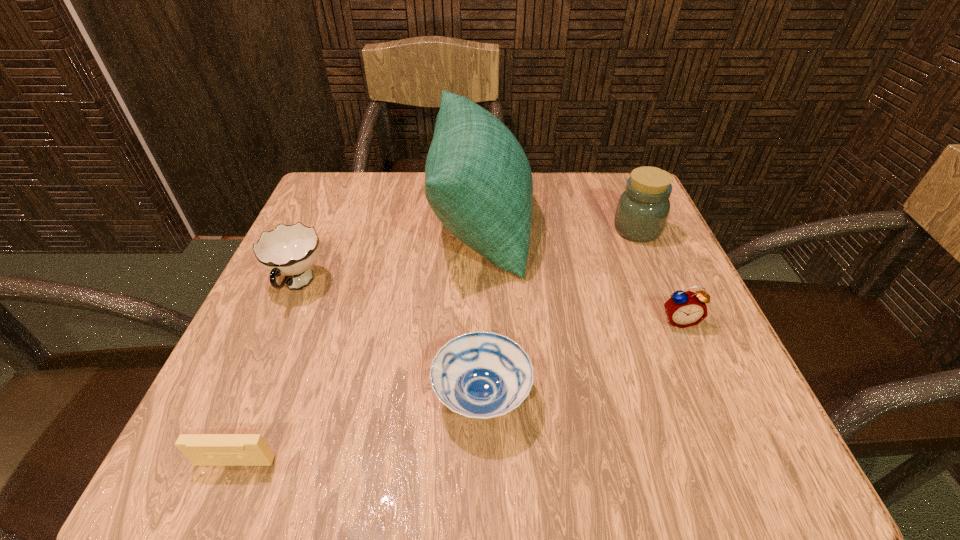
This screenshot has height=540, width=960. I want to click on object situated at the far right corner, so click(x=642, y=211).

Where is `vacant space at the far edge`? vacant space at the far edge is located at coordinates (567, 208).

This screenshot has width=960, height=540. I want to click on blank space at the near edge of the desktop, so (418, 452).

Identify the location of blank space at the left edge. The height and width of the screenshot is (540, 960). (229, 410).

This screenshot has width=960, height=540. What are the coordinates of `free space at the right edge` in the screenshot? It's located at (611, 248).

Image resolution: width=960 pixels, height=540 pixels. In the image, there is a desktop. What are the coordinates of `free space at the far left corner` in the screenshot? It's located at (348, 197).

The image size is (960, 540). I want to click on free spot at the near left corner of the desktop, so click(x=284, y=470).

Locate an element on the screen. vacant space at the far right corner is located at coordinates (586, 174).

At what (x,y) coordinates should I click in order to perform the action: click on free space between the alarm clock and the fifth shortest object. Please return your answer as a coordinate pair (x, y). Looking at the image, I should click on (658, 275).

The image size is (960, 540). What are the coordinates of `free space between the cushion and the fifth shortest object` in the screenshot? It's located at (559, 225).